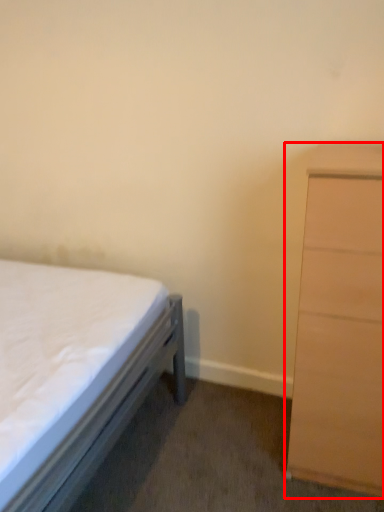
Question: From the image's perspective, what is the correct spatial relationship of chest of drawers (annotated by the red box) in relation to bed?

Choices:
 (A) above
 (B) below

Answer: (A)